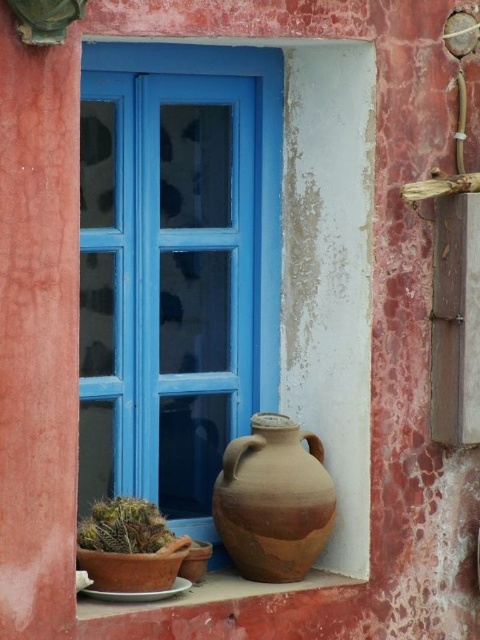
Between point (204, 122) and point (194, 573), which one is positioned behind?

Positioned behind is point (204, 122).

Is blue painted wood door at center shorter than brown matte vase at lower center?

No, blue painted wood door at center is not shorter than brown matte vase at lower center.

Which is behind, point (87, 200) or point (200, 563)?

Positioned behind is point (87, 200).

Where is `blue painted wood door at center`? The width and height of the screenshot is (480, 640). blue painted wood door at center is located at coordinates point(171,275).

Between brown clay pot at center and green matte cactus at lower left, which one has less height?

With less height is green matte cactus at lower left.

Between brown clay pot at center and green matte cactus at lower left, which one appears on the right side from the viewer's perspective?

Positioned to the right is brown clay pot at center.

Which is in front, point (227, 515) or point (156, 545)?

Point (156, 545)

Locate an element on the screen. This screenshot has width=480, height=640. brown clay pot at center is located at coordinates (274, 500).

Does terracotta pot at lower center appear on the right side of terracotta clay pot at lower left?

Yes, terracotta pot at lower center is to the right of terracotta clay pot at lower left.

Between point (222, 588) and point (160, 566), which one is positioned in front?

Point (160, 566) is in front.

Is point (229, 573) closer to camera compared to point (116, 589)?

No, it is behind (116, 589).

The height and width of the screenshot is (640, 480). Identify the location of terracotta pot at lower center. (204, 593).